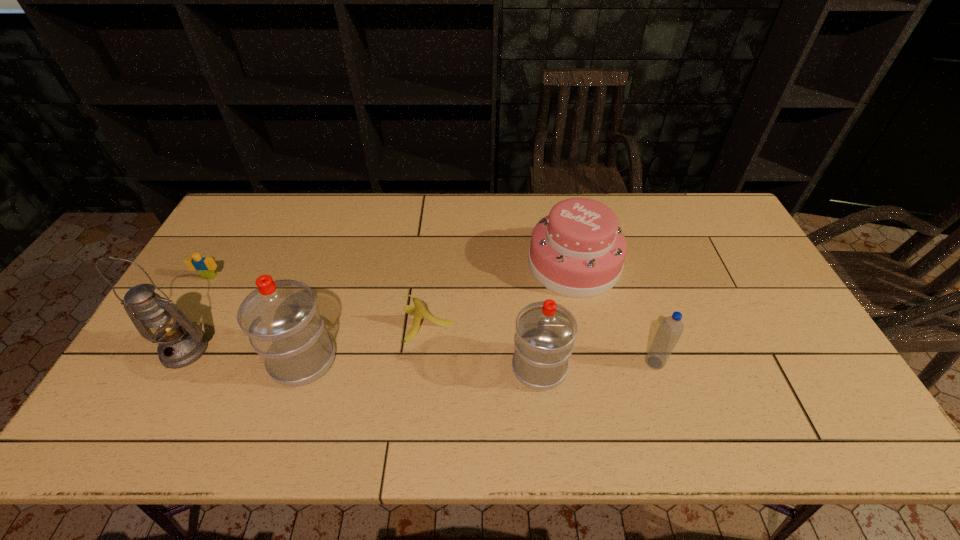
Locate an element on the screen. water bottle that is the closest to the Lego is located at coordinates pyautogui.click(x=281, y=318).

Where is `water bottle object that ranks as the closest to the oil lamp`? This screenshot has height=540, width=960. water bottle object that ranks as the closest to the oil lamp is located at coordinates (281, 318).

The width and height of the screenshot is (960, 540). Identify the location of blank space that satisfies the following two spatial constraints: 1. on the face of the oil lamp; 2. on the right side of the Lego. (166, 350).

In order to click on vacant area that satisfies the following two spatial constraints: 1. on the handle side of the cake; 2. on the right side of the leftmost water bottle in this screenshot , I will do `click(334, 264)`.

The height and width of the screenshot is (540, 960). What are the coordinates of `vacant space that satisfies the following two spatial constraints: 1. on the back side of the cake; 2. on the left side of the oil lamp` in the screenshot? It's located at (232, 264).

Find the location of `vacant space that satisfies the following two spatial constraints: 1. on the face of the Lego; 2. on the right side of the fourth object from left to right`. vacant space that satisfies the following two spatial constraints: 1. on the face of the Lego; 2. on the right side of the fourth object from left to right is located at coordinates (181, 324).